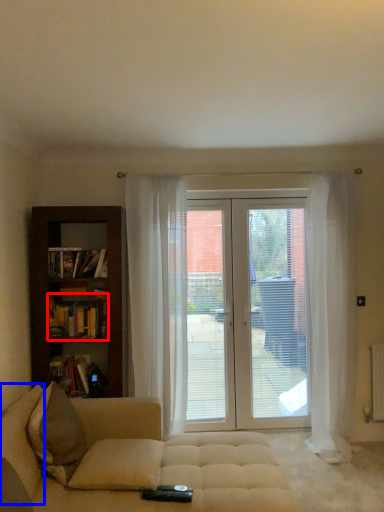
Question: Which object is closer to the camera taking this photo, book (highlighted by a red box) or pillow (highlighted by a blue box)?

Choices:
 (A) book
 (B) pillow

Answer: (B)